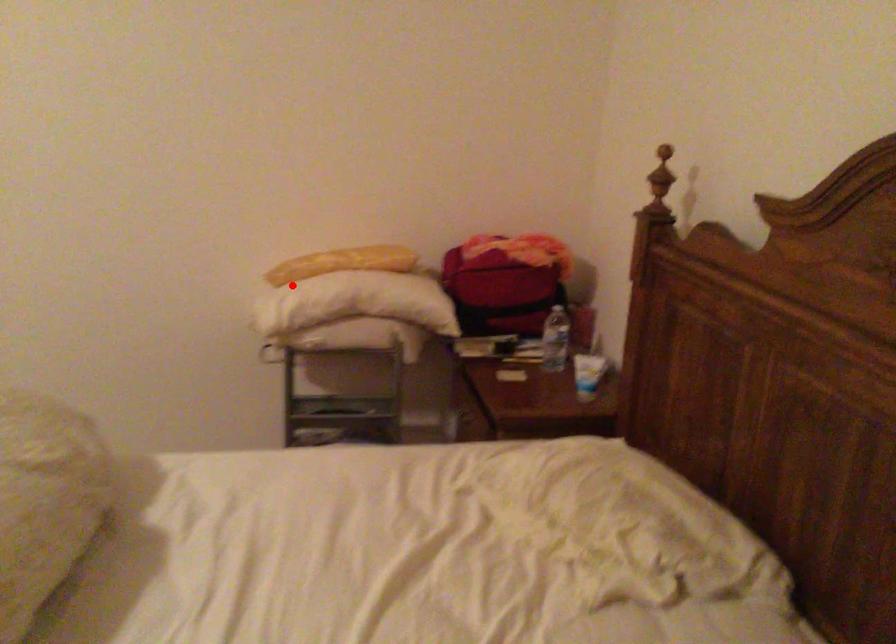
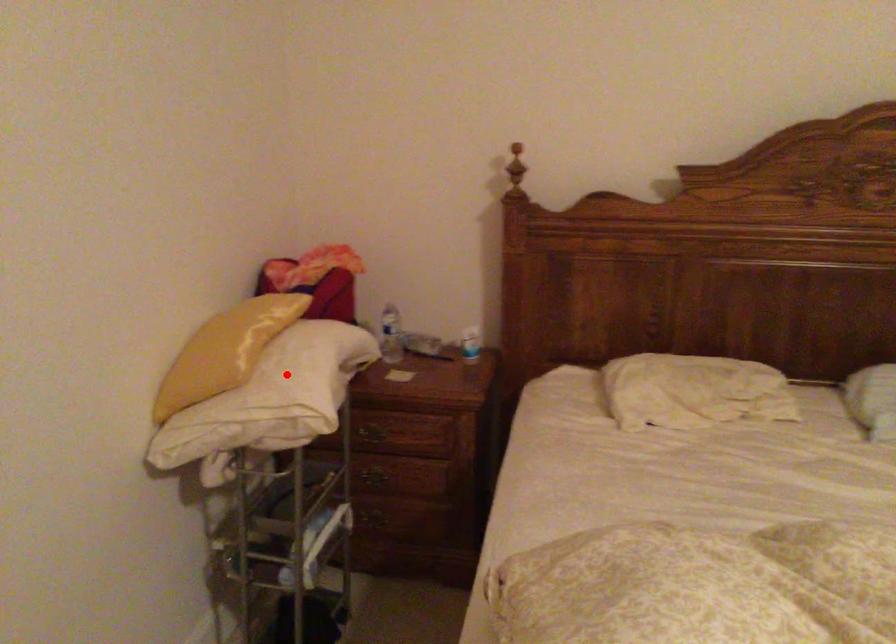
I am providing you with two images of the same scene from different viewpoints. A red point is marked on the first image and another point is marked on the second image. Is the marked point in image1 the same physical position as the marked point in image2?

Yes